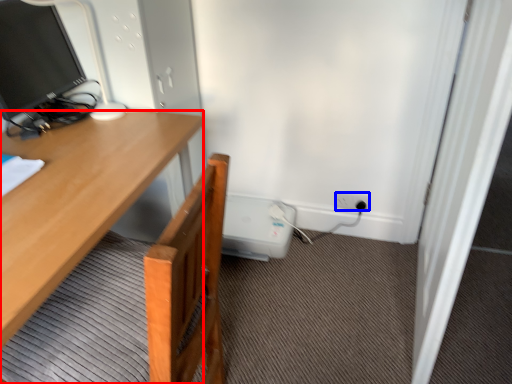
Question: Which of the following is the closest to the observer, desk (highlighted by a red box) or power outlet (highlighted by a blue box)?

Choices:
 (A) desk
 (B) power outlet

Answer: (A)